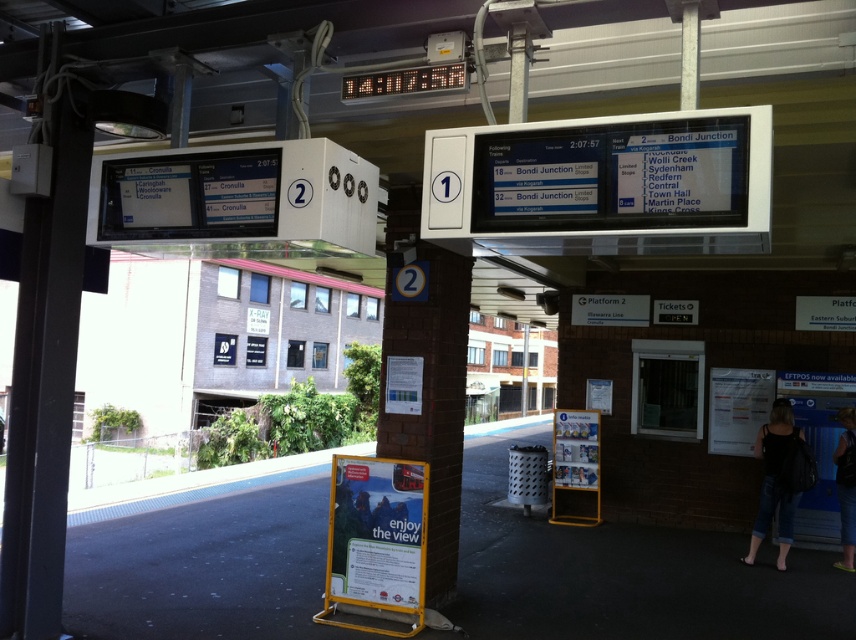
Between denim jeans at lower right and dark blue denim jeans at lower right, which one has less height?

Standing shorter between the two is dark blue denim jeans at lower right.

Is denim jeans at lower right closer to the viewer compared to dark blue denim jeans at lower right?

Yes, denim jeans at lower right is in front of dark blue denim jeans at lower right.

The width and height of the screenshot is (856, 640). What are the coordinates of `denim jeans at lower right` in the screenshot? It's located at (774, 481).